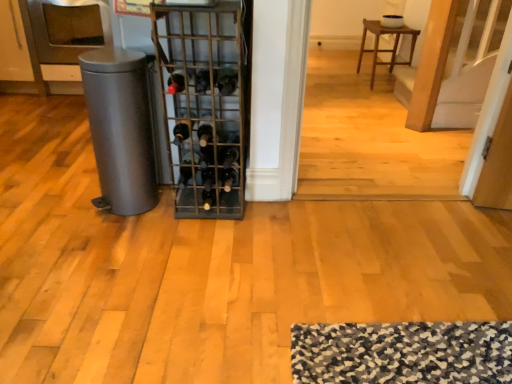
At what (x,y) coordinates should I click in order to perform the action: click on vacant area to the right of metallic wire wine rack at center. Please return your answer as a coordinate pair (x, y). The height and width of the screenshot is (384, 512). Looking at the image, I should click on (272, 220).